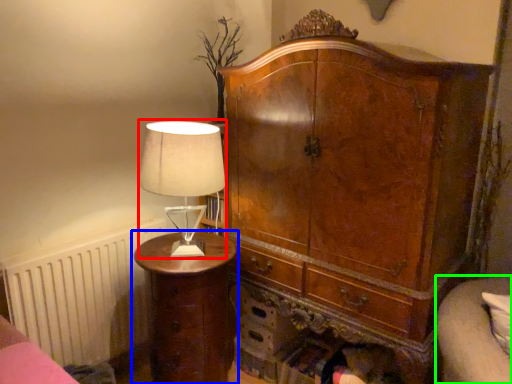
Question: Which is nearer to the table lamp (highlighted by a red box)? nightstand (highlighted by a blue box) or couch (highlighted by a green box).

Choices:
 (A) nightstand
 (B) couch

Answer: (A)